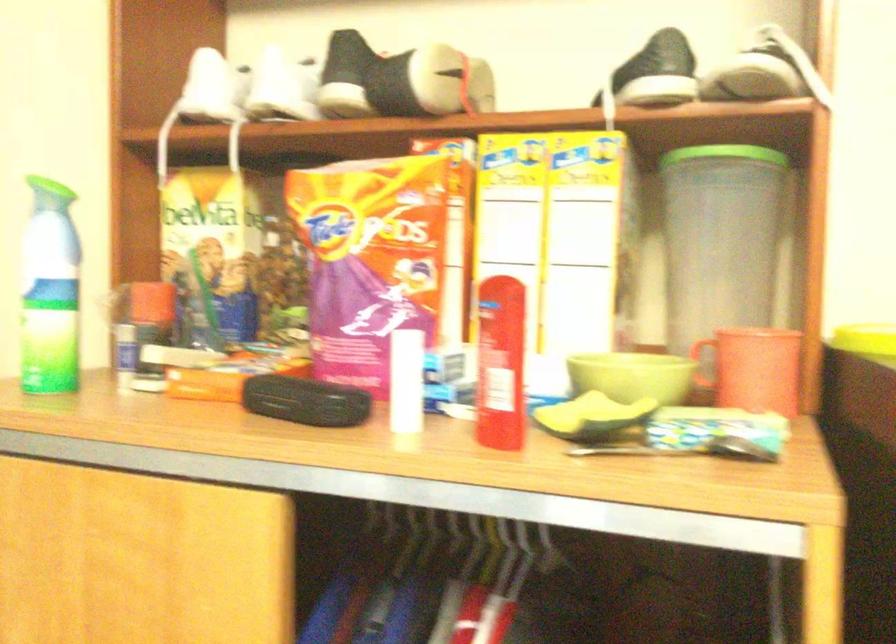
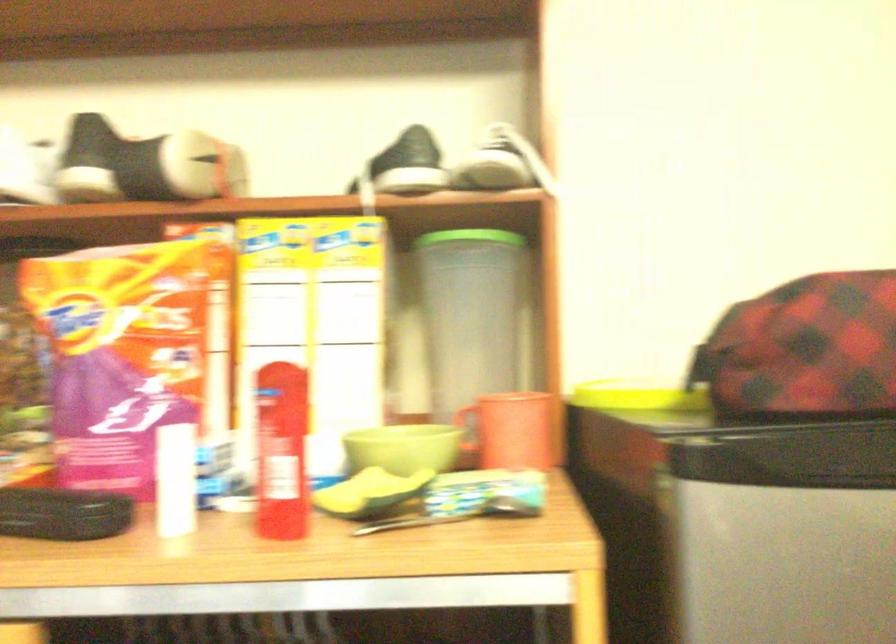
Question: What movement of the cameraman would produce the second image?

Choices:
 (A) Left
 (B) Right
 (C) Forward
 (D) Backward

Answer: (A)